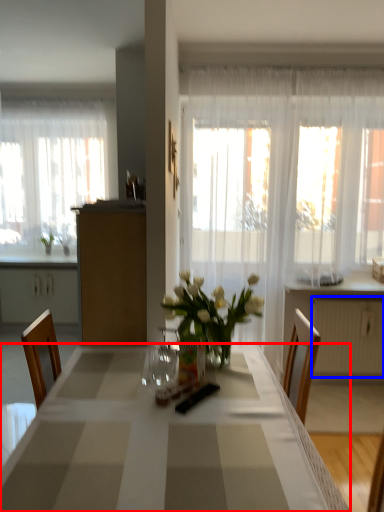
Question: Which of the following is the closest to the observer, desk (highlighted by a red box) or radiator (highlighted by a blue box)?

Choices:
 (A) desk
 (B) radiator

Answer: (A)